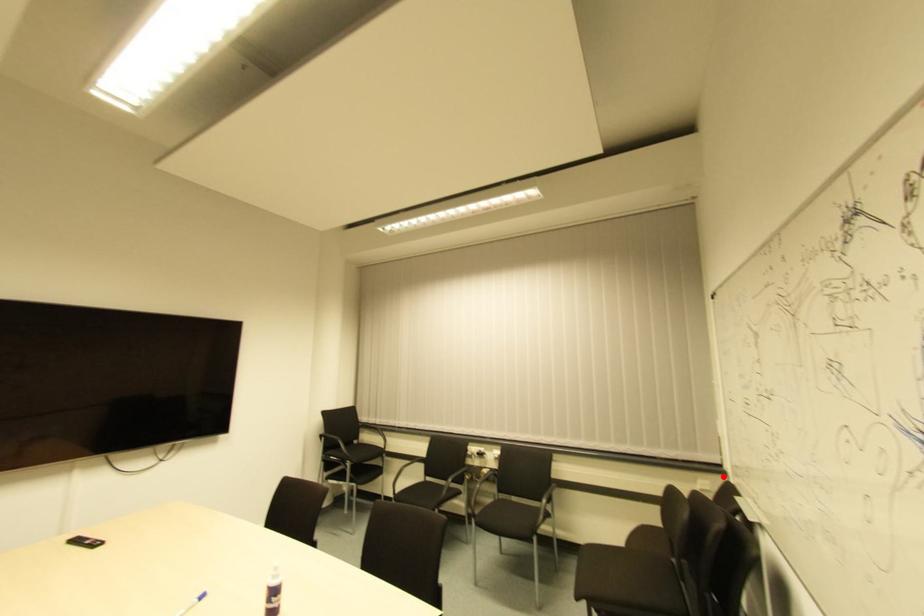
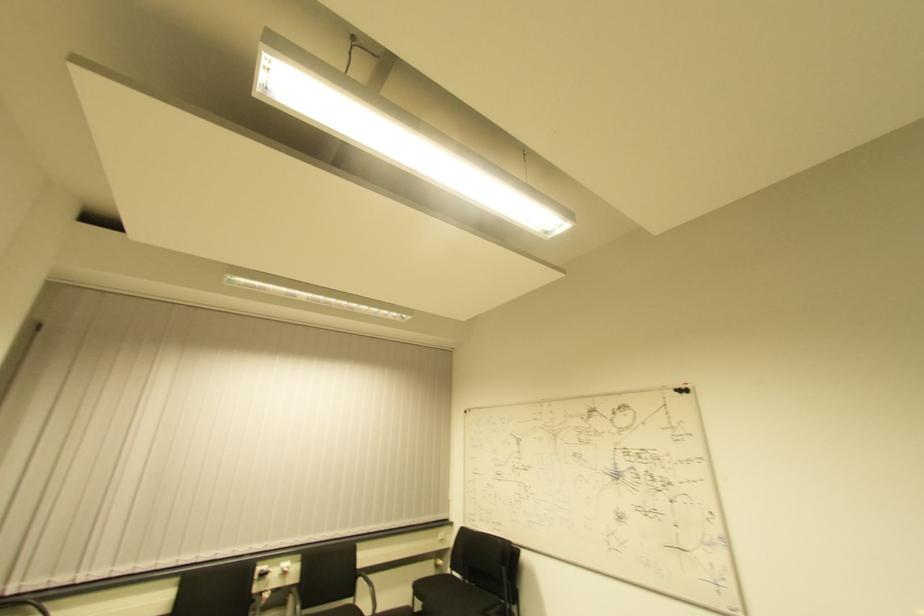
Locate, in the second image, the point that corresponds to the highlighted location in the first image.

(450, 527)